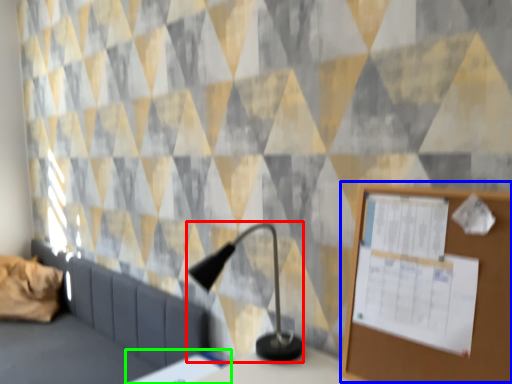
Question: Which object is the closest to the table lamp (highlighted by a red box)? Choose among these: bulletin board (highlighted by a blue box) or table (highlighted by a green box).

Choices:
 (A) bulletin board
 (B) table

Answer: (B)